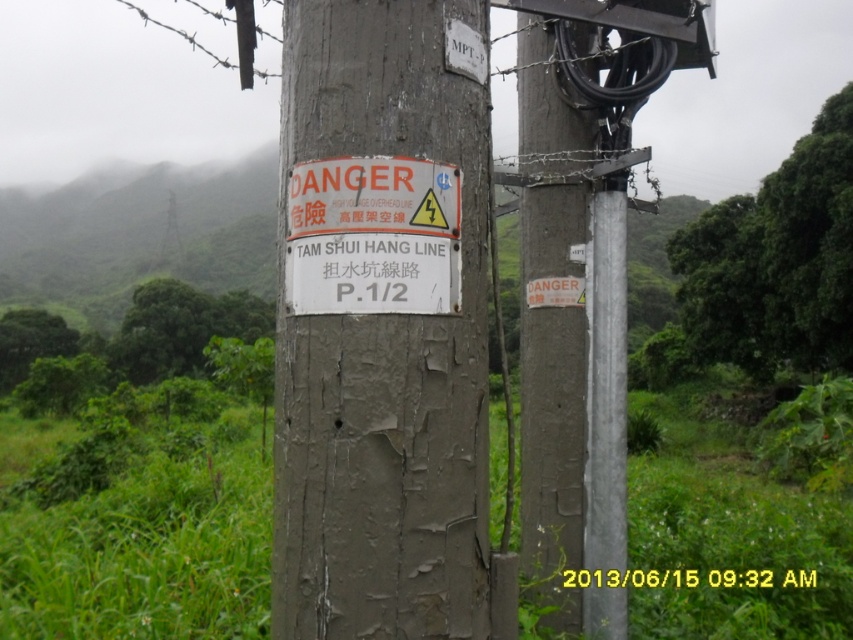
You are a delivery person trying to secure a package to the weathered wood post at right and the white paper sign at center. Since the post is larger than the sign, which object would require more tape to wrap around its circumference?

The weathered wood post at right is larger in size than the white paper sign at center, so it would require more tape to wrap around its circumference.

You are a surveyor measuring the distance between two wooden posts in a hilly area. The gray weathered wood post at center and the weathered wood post at right are part of an electrical hazard warning system. Can a 2.5 meter long safety barrier be placed between them without overlapping either post?

The distance between the gray weathered wood post at center and the weathered wood post at right is 2.27 meters. Since the safety barrier is 2.5 meters long, which is longer than the space between them, it cannot be placed without overlapping the posts.